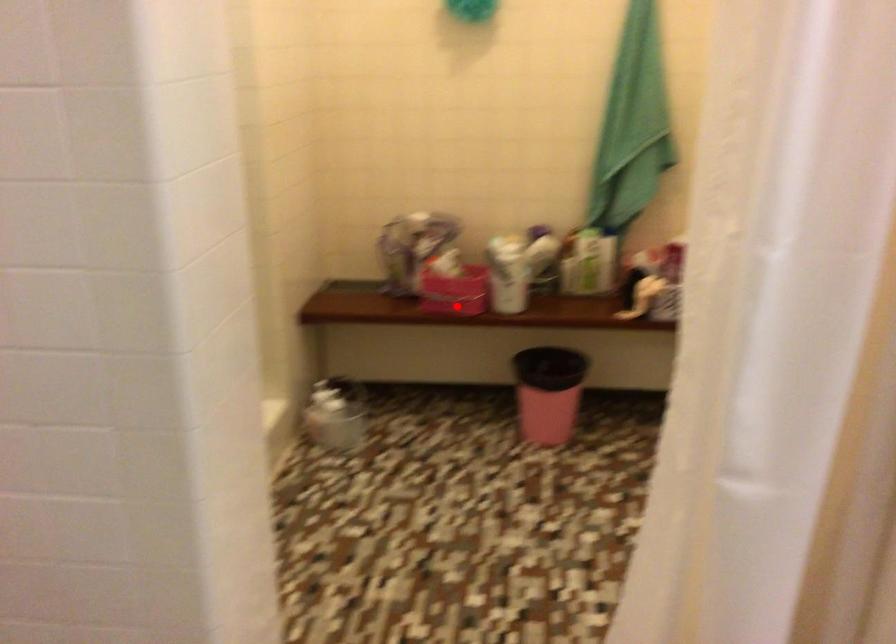
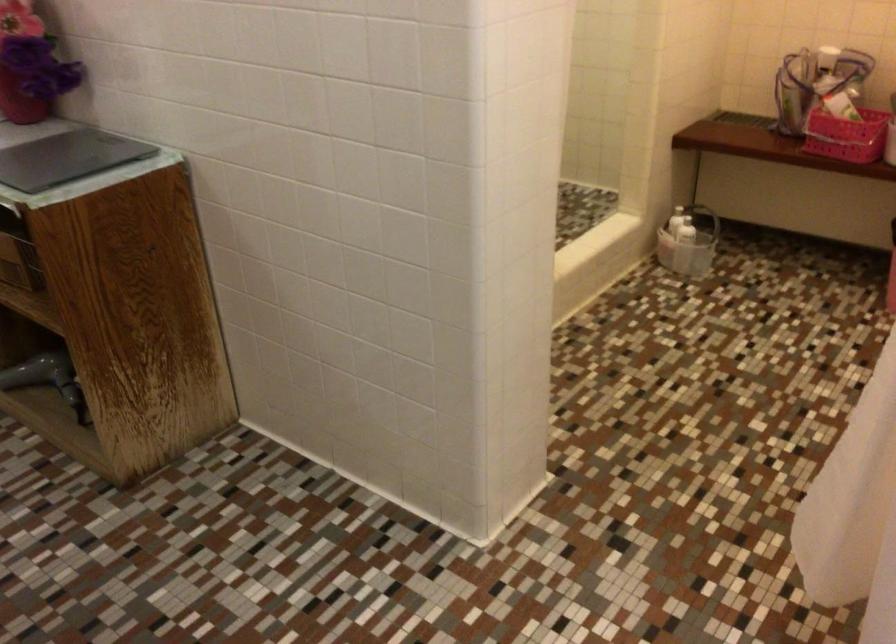
Question: A red point is marked in image1. In image2, is the corresponding 3D point closer to the camera or farther? Reply with the corresponding letter.

Choices:
 (A) The corresponding 3D point is closer.
 (B) The corresponding 3D point is farther.

Answer: (A)